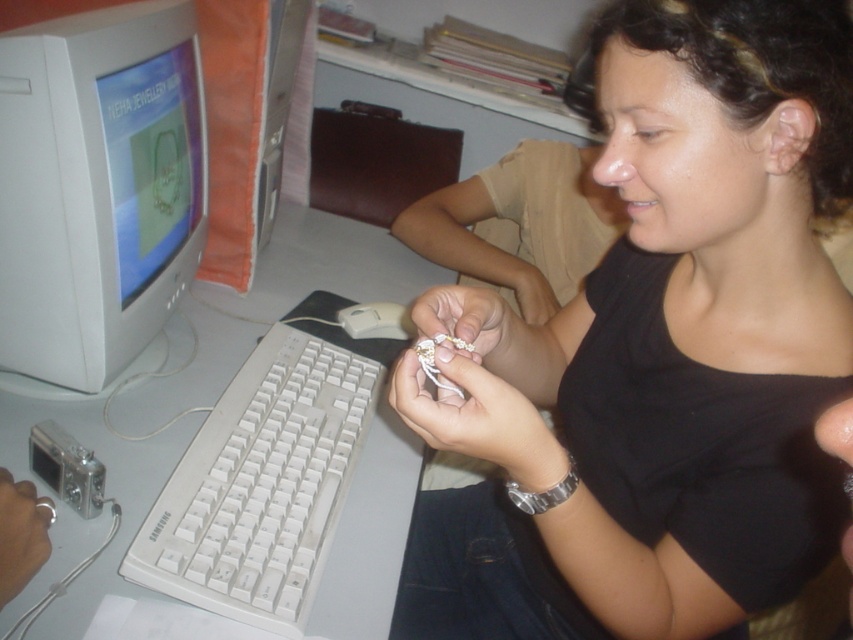
Question: Which of the following is the farthest from the observer?

Choices:
 (A) matte black shirt at center
 (B) gold metallic ring at center
 (C) white plastic mouse at center

Answer: (C)

Question: Can you confirm if gold metallic ring at center is wider than white matte wire at center?

Choices:
 (A) yes
 (B) no

Answer: (B)

Question: Is gold metallic ring at center to the right of white matte wire at center from the viewer's perspective?

Choices:
 (A) yes
 (B) no

Answer: (B)

Question: Which is farther from the white plastic keyboard at lower left?

Choices:
 (A) white plastic mouse at center
 (B) gold metallic ring at center
 (C) matte black shirt at center

Answer: (A)

Question: Which point is farther from the camera taking this photo?

Choices:
 (A) (289, 564)
 (B) (386, 316)
 (C) (440, 310)

Answer: (B)

Question: Is white plastic keyboard at lower left to the left of white matte wire at center from the viewer's perspective?

Choices:
 (A) no
 (B) yes

Answer: (B)